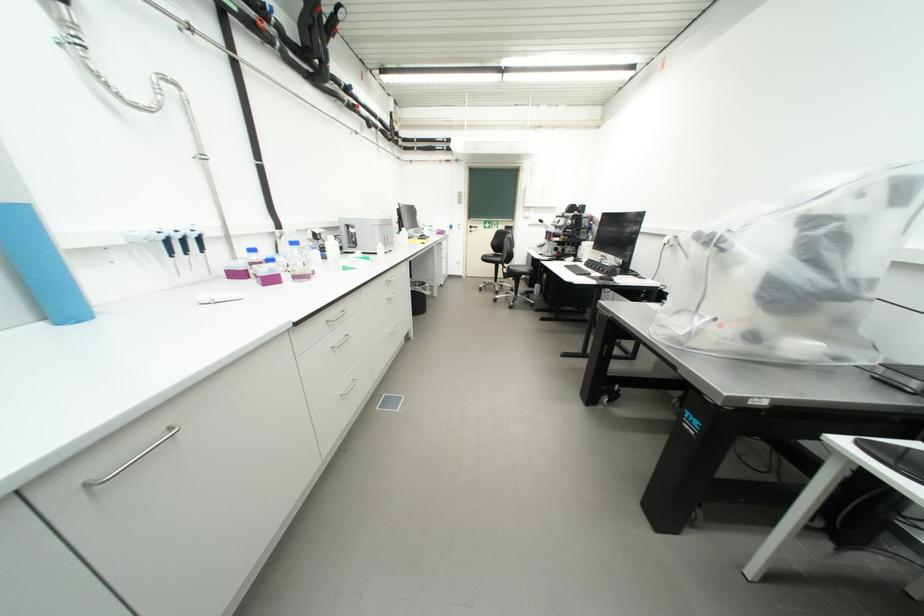
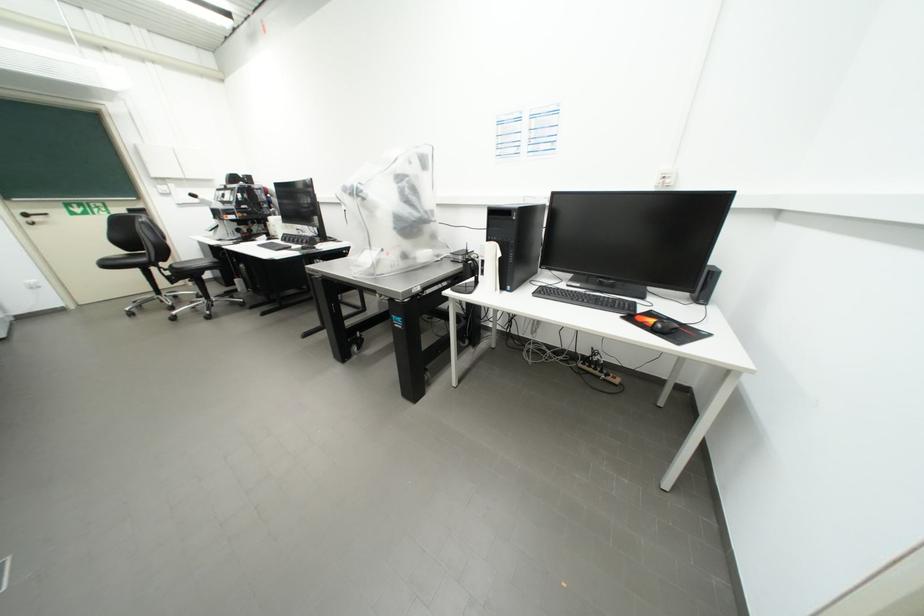
Locate, in the second image, the point that corresponds to (x=699, y=346) in the first image.

(385, 274)